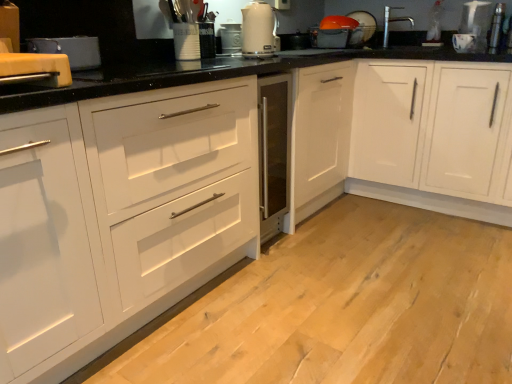
Question: From the image's perspective, is white glossy electric kettle at upper center on metallic silver toaster at center, which is counted as the third appliance, starting from the back?

Choices:
 (A) no
 (B) yes

Answer: (A)

Question: Does white glossy electric kettle at upper center lie in front of metallic silver toaster at center, the 3th appliance in the right-to-left sequence?

Choices:
 (A) no
 (B) yes

Answer: (B)

Question: From a real-world perspective, is white glossy electric kettle at upper center located beneath metallic silver toaster at center, placed as the third appliance when sorted from top to bottom?

Choices:
 (A) no
 (B) yes

Answer: (A)

Question: Is white glossy electric kettle at upper center not near metallic silver toaster at center, which is counted as the third appliance, starting from the back?

Choices:
 (A) yes
 (B) no

Answer: (B)

Question: Can you confirm if white glossy electric kettle at upper center is shorter than metallic silver toaster at center, the 3th appliance in the right-to-left sequence?

Choices:
 (A) yes
 (B) no

Answer: (B)

Question: Is metallic silver toaster at center, which is the 2th appliance in left-to-right order, located within white glossy electric kettle at upper center?

Choices:
 (A) no
 (B) yes

Answer: (A)

Question: From the image's perspective, would you say matte white dish drainer at upper right, placed as the 1th appliance when sorted from top to bottom, is positioned over silver metallic faucet at upper right?

Choices:
 (A) yes
 (B) no

Answer: (A)

Question: Is matte white dish drainer at upper right, placed as the 1th appliance when sorted from top to bottom, to the left of silver metallic faucet at upper right from the viewer's perspective?

Choices:
 (A) yes
 (B) no

Answer: (A)

Question: Is matte white dish drainer at upper right, which appears as the 4th appliance when viewed from the front, located outside silver metallic faucet at upper right?

Choices:
 (A) no
 (B) yes

Answer: (B)

Question: Does matte white dish drainer at upper right, which appears as the 4th appliance when viewed from the front, have a greater width compared to silver metallic faucet at upper right?

Choices:
 (A) no
 (B) yes

Answer: (A)

Question: Is there a large distance between matte white dish drainer at upper right, which appears as the 4th appliance when viewed from the front, and silver metallic faucet at upper right?

Choices:
 (A) no
 (B) yes

Answer: (A)

Question: Is matte white dish drainer at upper right, which appears as the fourth appliance when ordered from the bottom, turned away from silver metallic faucet at upper right?

Choices:
 (A) yes
 (B) no

Answer: (B)

Question: Is white matte cabinet at center, the second cabinetry from the right, not within metallic silver toaster at upper right, the 2th appliance when ordered from back to front?

Choices:
 (A) no
 (B) yes

Answer: (B)